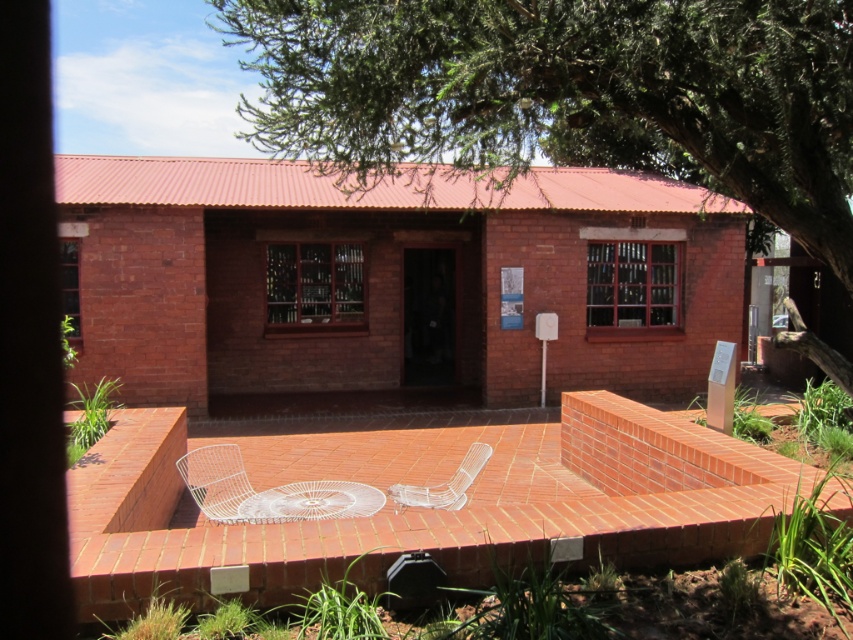
Between green leafy tree at upper center and clear wire chair at center, which one has more height?

green leafy tree at upper center is taller.

In the scene shown: Which is more to the left, green leafy tree at upper center or clear wire chair at center?

Positioned to the left is green leafy tree at upper center.

Which is in front, point (804, 236) or point (393, 506)?

Point (804, 236) is in front.

This screenshot has height=640, width=853. I want to click on green leafy tree at upper center, so click(567, 93).

Who is more distant from viewer, (294,493) or (210,460)?

The point (210,460) is behind.

Which is below, white wire table at center or white wire chair at center?

white wire table at center

Between point (378, 493) and point (210, 515), which one is positioned in front?

Point (210, 515) is in front.

Where is `white wire table at center`? Image resolution: width=853 pixels, height=640 pixels. white wire table at center is located at coordinates (311, 500).

Does white wire chair at center appear on the left side of clear wire chair at center?

Yes, white wire chair at center is to the left of clear wire chair at center.

Does white wire chair at center appear on the right side of clear wire chair at center?

Incorrect, white wire chair at center is not on the right side of clear wire chair at center.

Is point (189, 461) less distant than point (392, 488)?

Yes, point (189, 461) is closer to viewer.

The width and height of the screenshot is (853, 640). Identify the location of white wire chair at center. (216, 481).